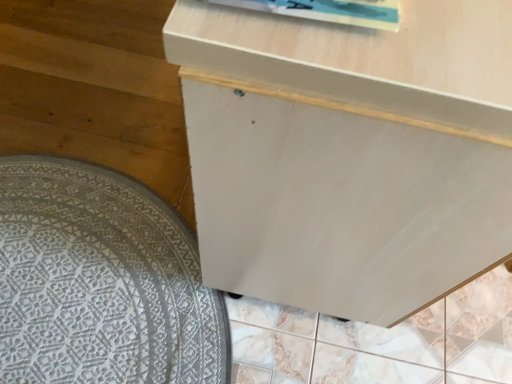
Question: Considering the relative sizes of white matte cabinet at center and white textured mat at lower left in the image provided, is white matte cabinet at center smaller than white textured mat at lower left?

Choices:
 (A) yes
 (B) no

Answer: (B)

Question: Considering the relative sizes of white matte cabinet at center and white textured mat at lower left in the image provided, is white matte cabinet at center bigger than white textured mat at lower left?

Choices:
 (A) no
 (B) yes

Answer: (B)

Question: Is the depth of white matte cabinet at center greater than that of white textured mat at lower left?

Choices:
 (A) no
 (B) yes

Answer: (A)

Question: Is white matte cabinet at center to the left of white textured mat at lower left from the viewer's perspective?

Choices:
 (A) yes
 (B) no

Answer: (B)

Question: From a real-world perspective, is white matte cabinet at center over white textured mat at lower left?

Choices:
 (A) no
 (B) yes

Answer: (B)

Question: Is white matte cabinet at center touching white textured mat at lower left?

Choices:
 (A) no
 (B) yes

Answer: (A)

Question: Is white textured mat at lower left smaller than white matte cabinet at center?

Choices:
 (A) yes
 (B) no

Answer: (A)

Question: Considering the relative sizes of white textured mat at lower left and white matte cabinet at center in the image provided, is white textured mat at lower left taller than white matte cabinet at center?

Choices:
 (A) no
 (B) yes

Answer: (A)

Question: Is white textured mat at lower left wider than white matte cabinet at center?

Choices:
 (A) yes
 (B) no

Answer: (A)

Question: Is white textured mat at lower left not close to white matte cabinet at center?

Choices:
 (A) no
 (B) yes

Answer: (A)

Question: From the image's perspective, does white textured mat at lower left appear higher than white matte cabinet at center?

Choices:
 (A) yes
 (B) no

Answer: (B)

Question: Is white textured mat at lower left shorter than white matte cabinet at center?

Choices:
 (A) no
 (B) yes

Answer: (B)

Question: Is white matte cabinet at center spatially inside white textured mat at lower left, or outside of it?

Choices:
 (A) outside
 (B) inside

Answer: (A)